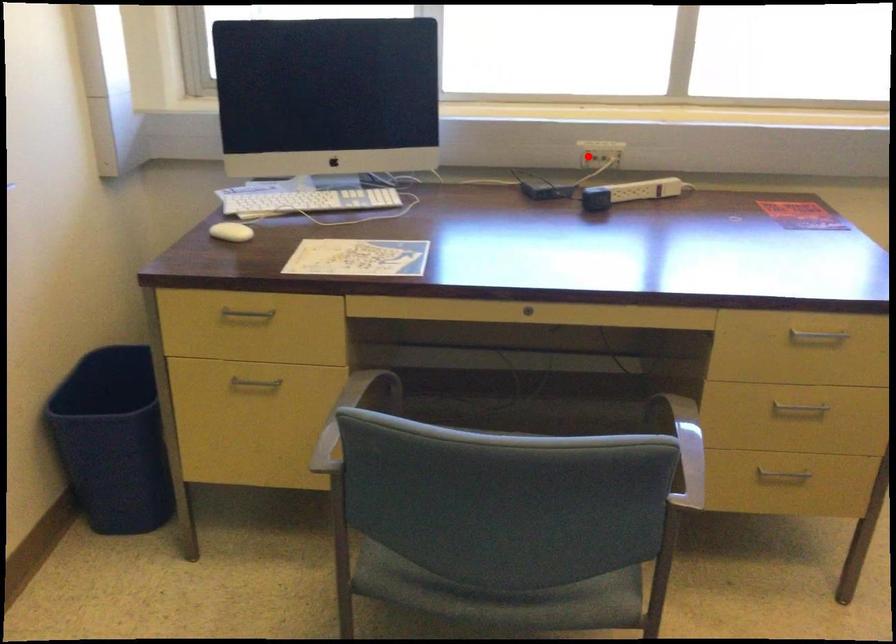
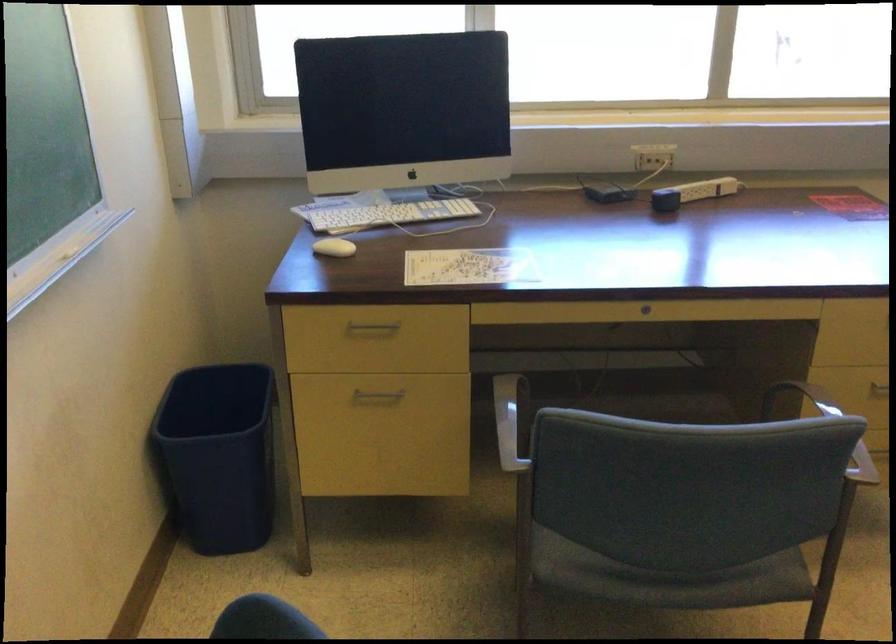
In the second image, find the point that corresponds to the highlighted location in the first image.

(643, 158)